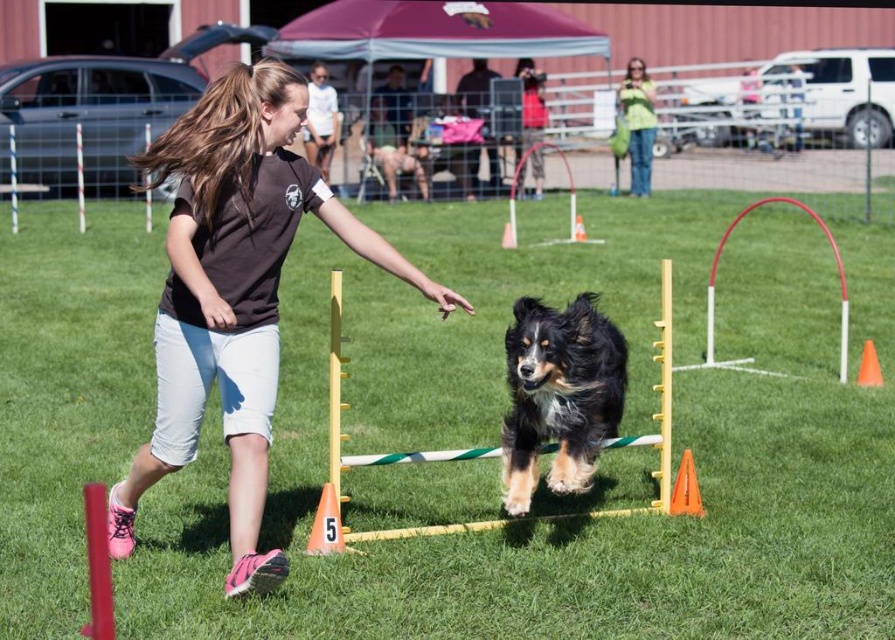
Between orange plastic cone at lower center and orange plastic cone at lower right, which one has less height?

orange plastic cone at lower right is shorter.

Between point (334, 524) and point (874, 371), which one is positioned in front?

Positioned in front is point (334, 524).

Image resolution: width=895 pixels, height=640 pixels. Identify the location of orange plastic cone at lower center. (326, 524).

Is orange plastic cone at center bigger than orange plastic cone at lower right?

Actually, orange plastic cone at center might be smaller than orange plastic cone at lower right.

Between point (695, 499) and point (879, 365), which one is positioned in front?

Positioned in front is point (695, 499).

Image resolution: width=895 pixels, height=640 pixels. What are the coordinates of `orange plastic cone at center` in the screenshot? It's located at pyautogui.click(x=685, y=488).

Which is in front, point (615, 348) or point (872, 349)?

Point (615, 348) is more forward.

Between point (570, 417) and point (861, 355), which one is positioned in front?

Point (570, 417) is more forward.

This screenshot has width=895, height=640. Identify the location of tri-colored fluffy dog at center. (559, 394).